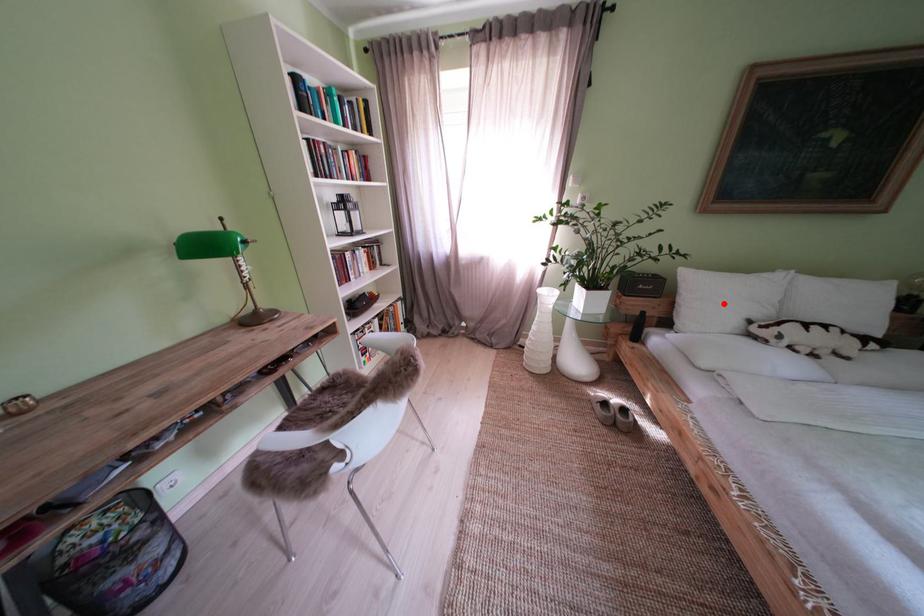
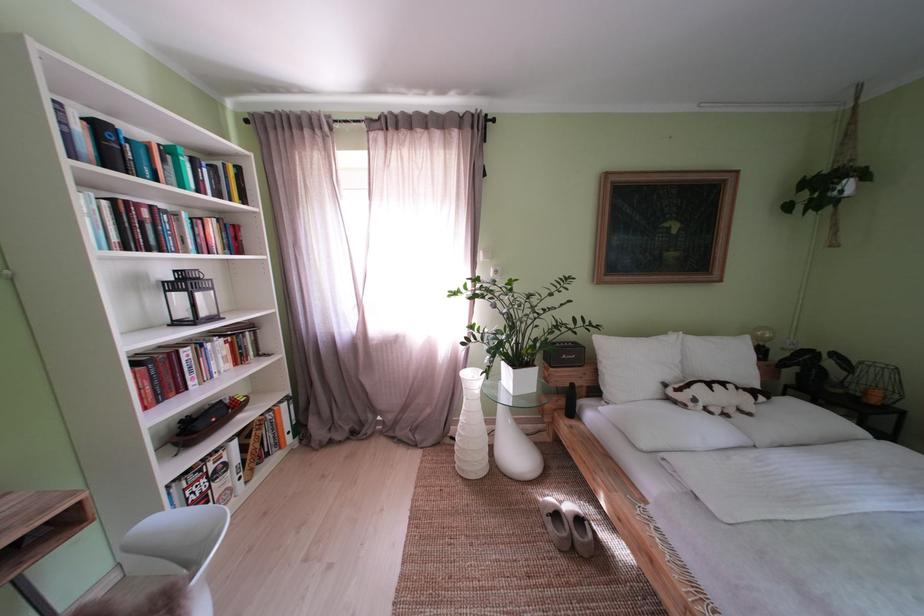
The point at the highlighted location is marked in the first image. Where is the corresponding point in the second image?

(639, 369)